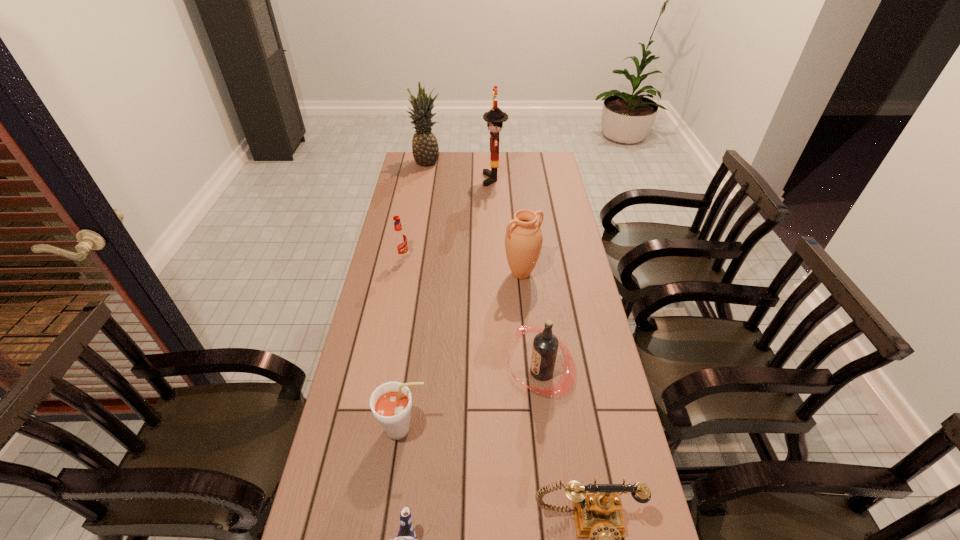
At what (x,y) coordinates should I click in order to perform the action: click on nutcracker. Please return your answer as a coordinate pair (x, y). This screenshot has width=960, height=540. Looking at the image, I should click on (495, 117).

Locate an element on the screen. pineapple is located at coordinates coord(425,150).

The height and width of the screenshot is (540, 960). Identify the location of the fourth farthest object. (523, 240).

What are the coordinates of `the fourth tallest object` in the screenshot? It's located at (545, 345).

At what (x,y) coordinates should I click in order to perform the action: click on the tallest root beer. Please return your answer as a coordinate pair (x, y). The width and height of the screenshot is (960, 540). Looking at the image, I should click on (545, 345).

Locate an element on the screen. This screenshot has width=960, height=540. the leftmost root beer is located at coordinates (399, 237).

This screenshot has width=960, height=540. Identify the location of the farthest root beer. (399, 237).

Locate an element on the screen. The image size is (960, 540). the sixth farthest object is located at coordinates (391, 403).

You are a GUI agent. You are given a task and a screenshot of the screen. Output one action in this format:
    pyautogui.click(x=<x>, y=<y>)
    Task: Click on the second root beer from right to left
    Image resolution: width=960 pixels, height=540 pixels.
    Given the screenshot: What is the action you would take?
    point(391,403)

Where is `free region located on the front-facing side of the nutcracker`? This screenshot has height=540, width=960. free region located on the front-facing side of the nutcracker is located at coordinates (416, 179).